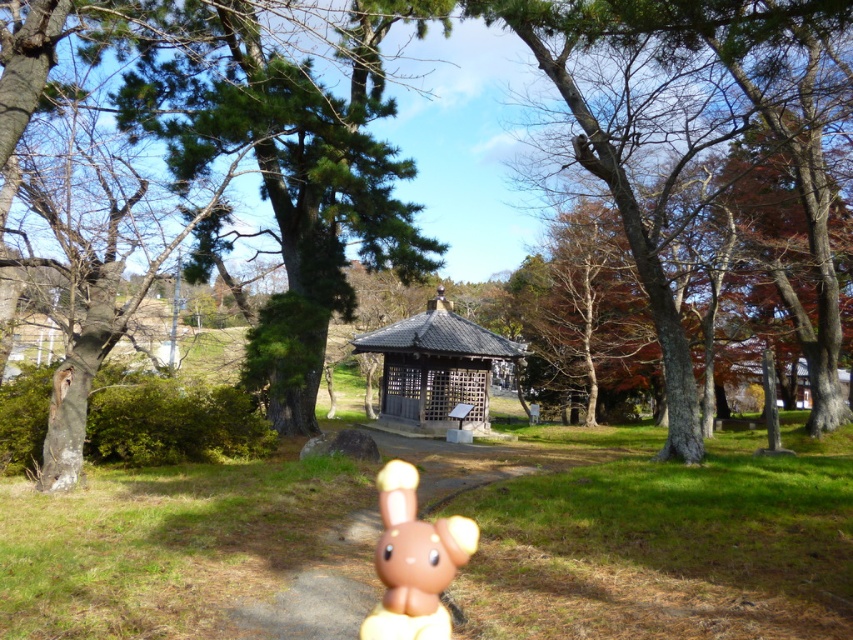
You are a photographer setting up a tripod in the park. You need to capture both the wooden lattice gazebo at center and the brown matte plush toy at center in your shot. Based on their heights, which object will appear larger in the photo?

The brown matte plush toy at center will appear larger in the photo since it is taller than the wooden lattice gazebo at center.

You are planning to place a new bench in the park scene. The bench requires a space wider than the wooden lattice gazebo at center. Can the brown wood tree at center provide enough space for the bench?

The brown wood tree at center has a width larger than the wooden lattice gazebo at center, so yes, the bench can be placed there as the space provided by the brown wood tree at center is wider than required.